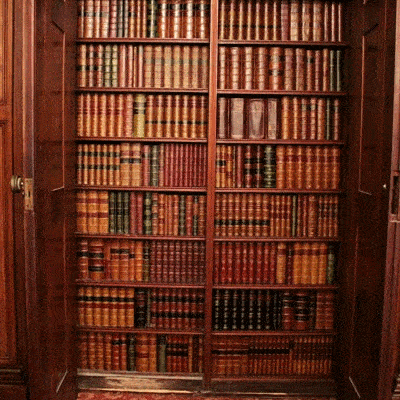
The width and height of the screenshot is (400, 400). I want to click on area of shelf that is worn, so click(x=145, y=384).